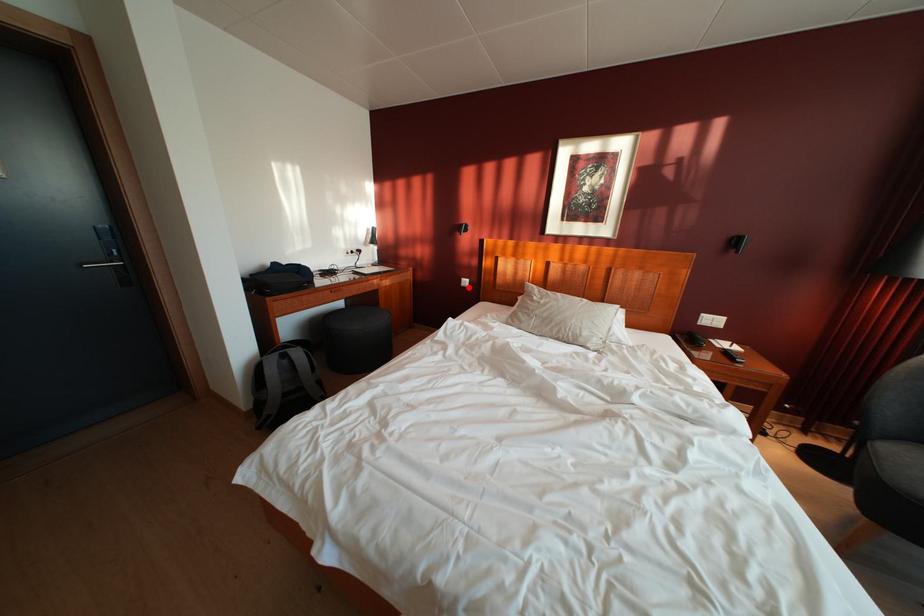
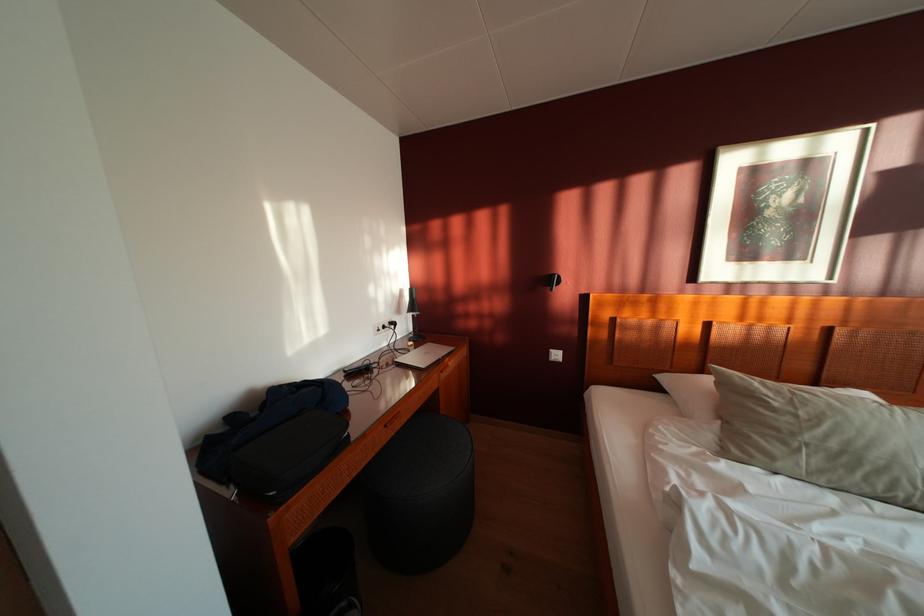
In the second image, find the point that corresponds to the highlighted location in the first image.

(555, 360)